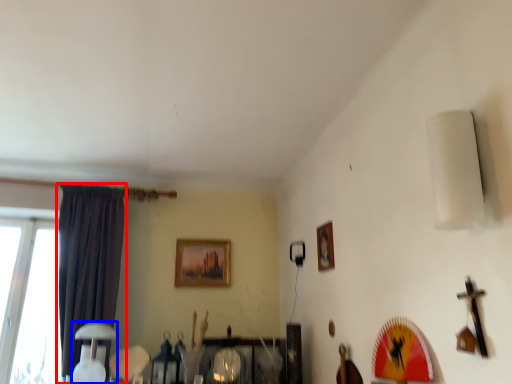
Question: Which object appears closest to the camera in this image, curtain (highlighted by a red box) or table lamp (highlighted by a blue box)?

Choices:
 (A) curtain
 (B) table lamp

Answer: (B)